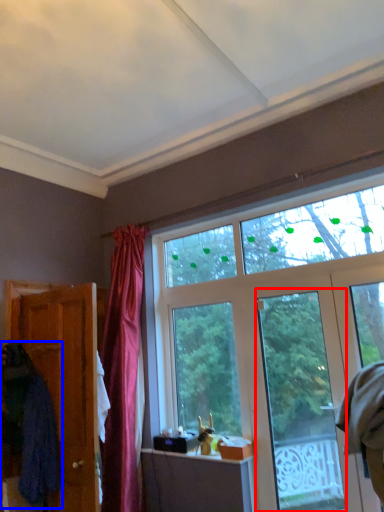
Question: Which of the following is the farthest to the observer, glass door (highlighted by a red box) or robe (highlighted by a blue box)?

Choices:
 (A) glass door
 (B) robe

Answer: (A)